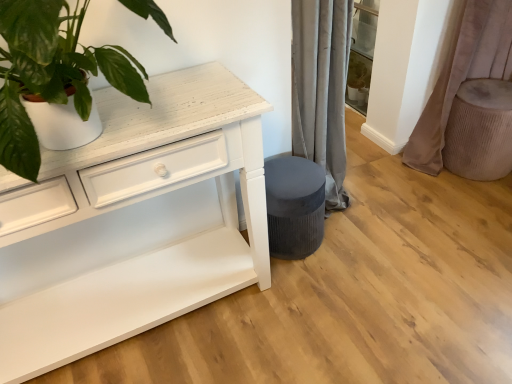
Image resolution: width=512 pixels, height=384 pixels. What are the coordinates of `empty space that is to the right of velvet dark gray stool at lower center` in the screenshot? It's located at (358, 243).